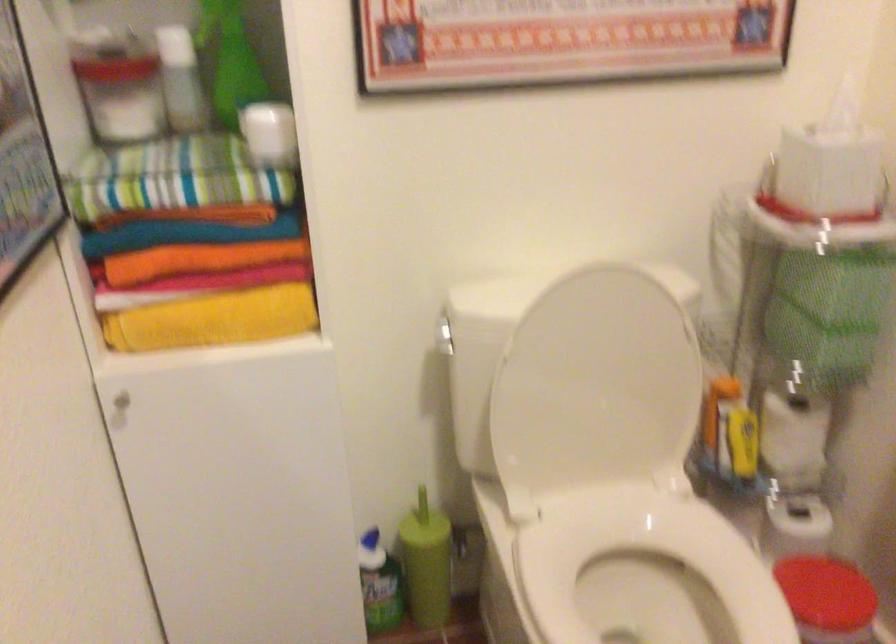
Describe the element at coordinates (824, 591) in the screenshot. I see `the red trash can lid` at that location.